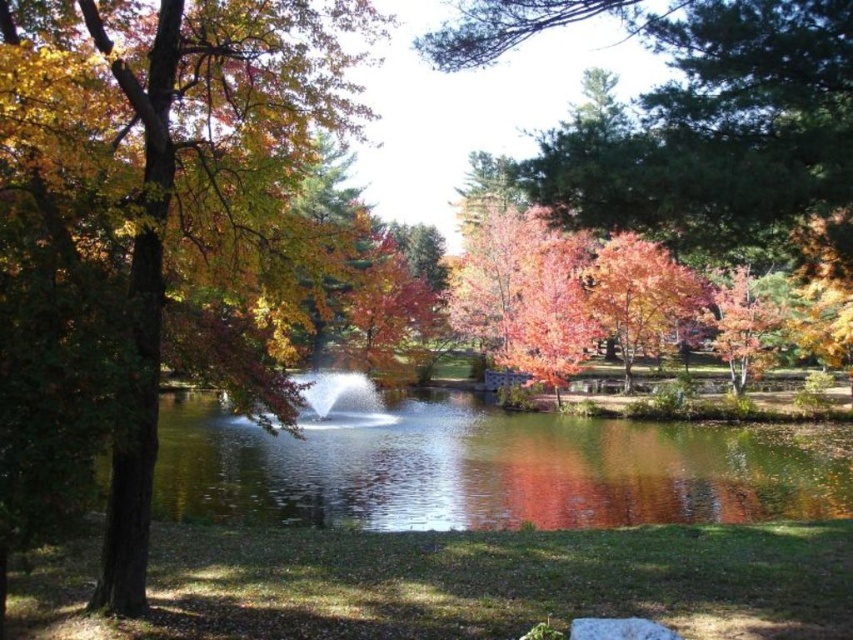
You are a bird flying over the autumnal scene. You see the matte brown tree trunk at left and the clear water at center. Which object is taller from your perspective?

The matte brown tree trunk at left is taller than the clear water at center, so the matte brown tree trunk at left is taller.

You are standing at the center of the pond and want to walk to the matte brown tree trunk at left. Which direction should you head to reach it?

The matte brown tree trunk at left is located at point 0.362 on the x and 0.171 on the y coordinate, so you should head towards the left direction to reach it.